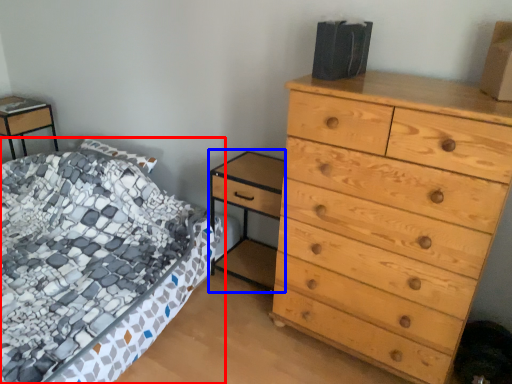
Question: Which object appears closest to the camera in this image, bed (highlighted by a red box) or nightstand (highlighted by a blue box)?

Choices:
 (A) bed
 (B) nightstand

Answer: (A)